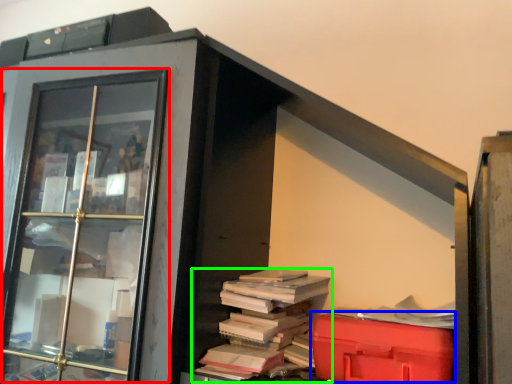
Question: Which object is positioned closest to glass door (highlighted by a red box)? Select from waste (highlighted by a blue box) and book (highlighted by a green box).

Choices:
 (A) waste
 (B) book

Answer: (B)